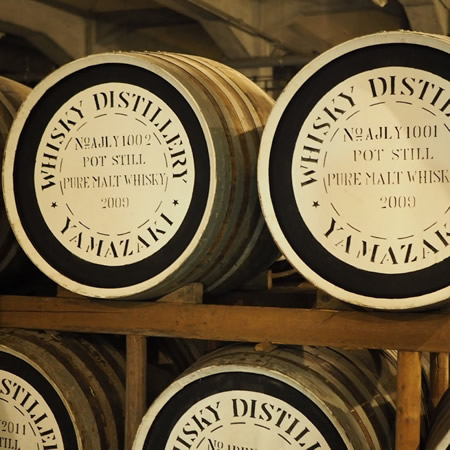
Locate an element on the screen. cream border is located at coordinates (133, 290).